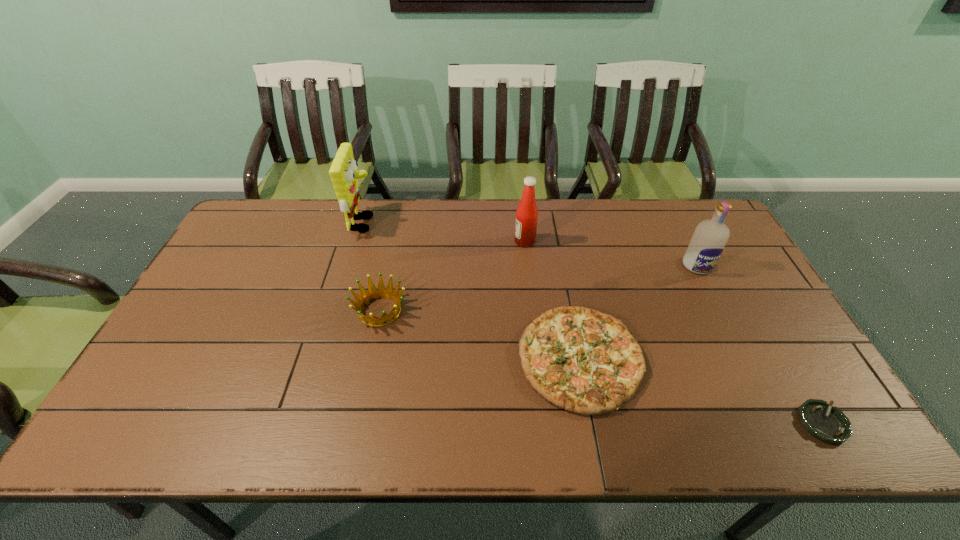
In order to click on vacant area located on the front-facing side of the condiment in this screenshot , I will do `click(481, 241)`.

This screenshot has width=960, height=540. Find the location of `vacant space located on the front-facing side of the condiment`. vacant space located on the front-facing side of the condiment is located at coordinates (487, 241).

The height and width of the screenshot is (540, 960). In order to click on free space located on the label of the vodka in this screenshot , I will do `click(759, 389)`.

The height and width of the screenshot is (540, 960). Identify the location of free space located 0.310m on the left of the crown. (243, 311).

This screenshot has height=540, width=960. Identify the location of vacant space situated 0.340m on the left of the second shortest object. (387, 359).

Locate an element on the screen. free space located on the left of the shortest object is located at coordinates (778, 423).

The image size is (960, 540). Identify the location of sponge present at the far edge. (343, 172).

Locate an element on the screen. condiment located in the far edge section of the desktop is located at coordinates (527, 213).

I want to click on pizza that is at the near edge, so click(x=587, y=362).

In order to click on ashtray at the near edge in this screenshot , I will do `click(829, 424)`.